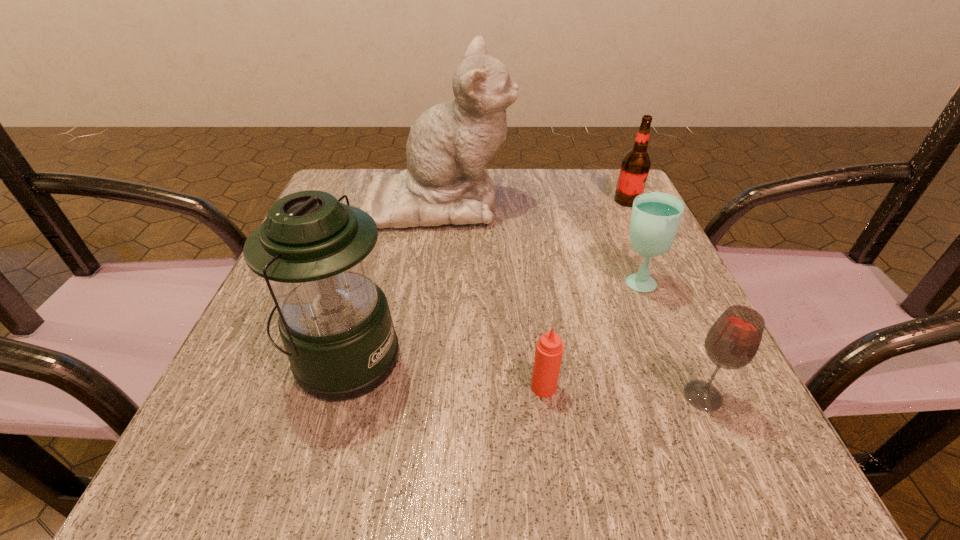
Locate an element on the screen. This screenshot has height=540, width=960. free space between the root beer and the tallest object is located at coordinates (533, 201).

Locate an element on the screen. The width and height of the screenshot is (960, 540). vacant space that is in between the third farthest object and the tallest object is located at coordinates (537, 241).

At what (x,y) coordinates should I click in order to perform the action: click on vacant region between the fourth nearest object and the lantern. Please return your answer as a coordinate pair (x, y). Looking at the image, I should click on (490, 320).

At what (x,y) coordinates should I click in order to perform the action: click on free space that is in between the lantern and the fourth nearest object. Please return your answer as a coordinate pair (x, y). The width and height of the screenshot is (960, 540). Looking at the image, I should click on (490, 320).

You are a GUI agent. You are given a task and a screenshot of the screen. Output one action in this format:
    pyautogui.click(x=<x>, y=<y>)
    Task: Click on the empty space between the farther glass drink container and the cat
    This screenshot has width=960, height=540.
    Given the screenshot: What is the action you would take?
    pyautogui.click(x=537, y=241)

Locate an element on the screen. This screenshot has height=540, width=960. object that can be found as the closest to the farther glass drink container is located at coordinates (733, 340).

Find the location of a particular element. Image resolution: width=960 pixels, height=540 pixels. object that ranks as the second closest to the root beer is located at coordinates (446, 182).

Where is `vacant space that satisfies the following two spatial constraints: 1. on the front-facing side of the shortest object; 2. on the right side of the cat`? Image resolution: width=960 pixels, height=540 pixels. vacant space that satisfies the following two spatial constraints: 1. on the front-facing side of the shortest object; 2. on the right side of the cat is located at coordinates (413, 387).

Identify the location of vacant space that satisfies the following two spatial constraints: 1. on the back side of the nearer glass drink container; 2. on the front-facing side of the tallest object. (616, 201).

At what (x,y) coordinates should I click in order to perform the action: click on free space that satisfies the following two spatial constraints: 1. on the front-facing side of the cat; 2. on the back side of the shortest object. Please return your answer as a coordinate pair (x, y). The width and height of the screenshot is (960, 540). Looking at the image, I should click on (413, 387).